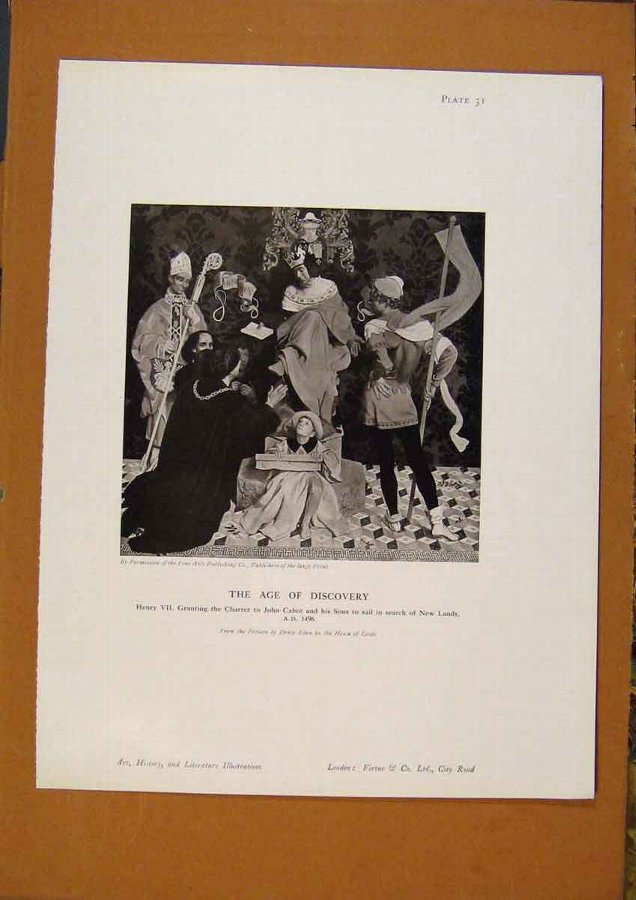
You are a GUI agent. You are given a task and a screenshot of the screen. Output one action in this format:
    pyautogui.click(x=<x>, y=<y>)
    Task: Click on the robe
    
    Given the screenshot: What is the action you would take?
    pyautogui.click(x=318, y=343)